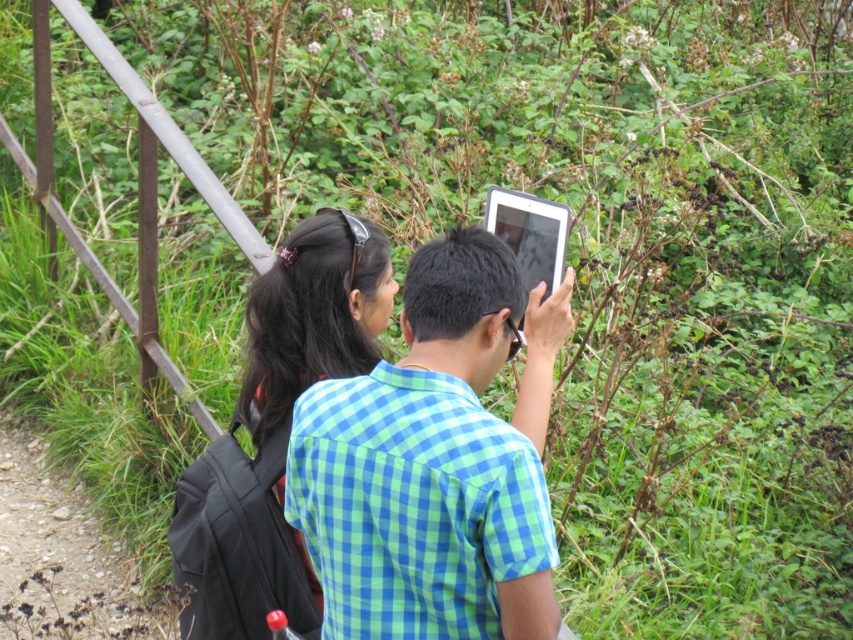
Question: Does black hair at upper center come behind silver metallic tablet at center?

Choices:
 (A) no
 (B) yes

Answer: (B)

Question: Which is nearer to the black hair at upper center?

Choices:
 (A) green checkered shirt at center
 (B) silver metallic tablet at center

Answer: (A)

Question: Which object is closer to the camera taking this photo?

Choices:
 (A) green checkered shirt at center
 (B) black hair at upper center
 (C) silver metallic tablet at center

Answer: (A)

Question: Which of the following is the farthest from the observer?

Choices:
 (A) (405, 573)
 (B) (250, 376)

Answer: (B)

Question: Can you confirm if green checkered shirt at center is bigger than black hair at upper center?

Choices:
 (A) no
 (B) yes

Answer: (B)

Question: Does green checkered shirt at center have a lesser width compared to black hair at upper center?

Choices:
 (A) no
 (B) yes

Answer: (A)